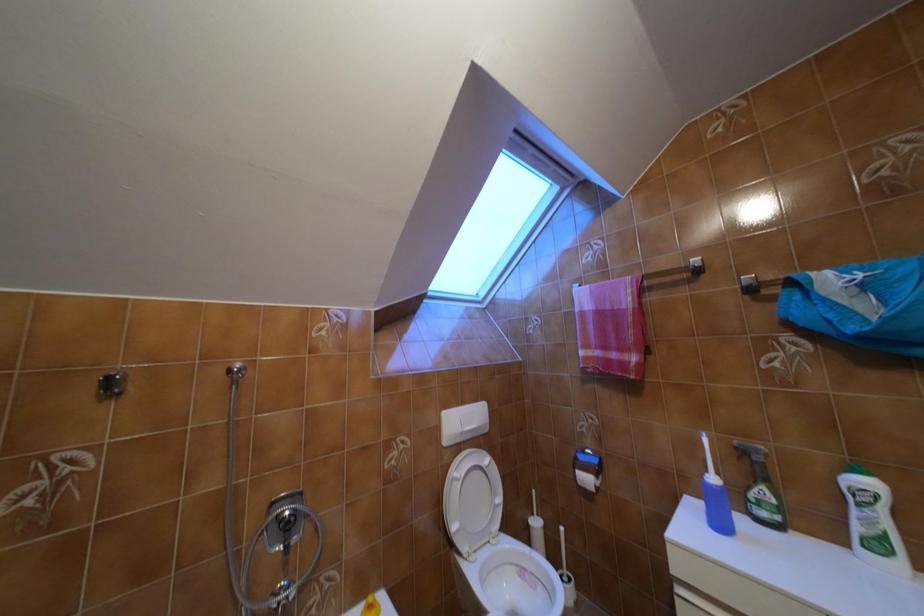
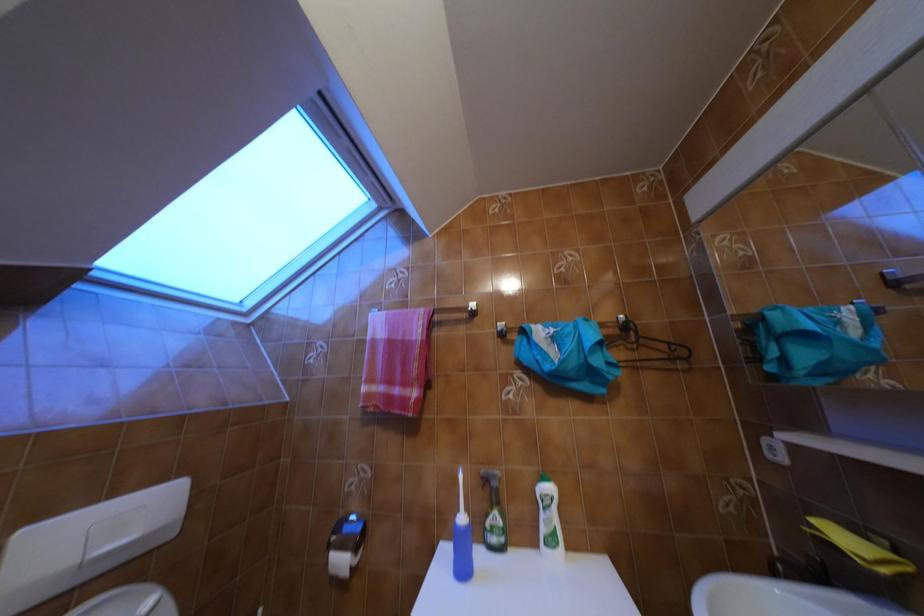
Question: Based on the continuous images, in which direction is the camera rotating? Reply with the corresponding letter.

Choices:
 (A) Left
 (B) Right
 (C) Up
 (D) Down

Answer: (B)